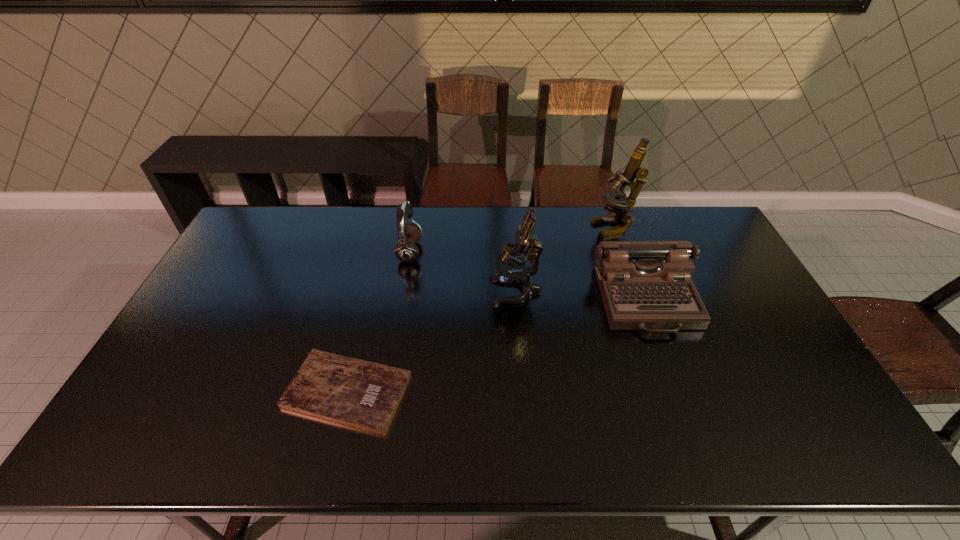
Locate an element on the screen. The height and width of the screenshot is (540, 960). vacant space positioned 0.160m at the eyepieces of the third object from right to left is located at coordinates (439, 292).

The height and width of the screenshot is (540, 960). In order to click on free location located 0.090m on the ear pads of the earphone in this screenshot , I will do `click(447, 252)`.

The height and width of the screenshot is (540, 960). In order to click on free space located on the keyboard of the second shortest object in this screenshot , I will do `click(672, 370)`.

Identify the location of vacant region located on the left of the nearest object. The image size is (960, 540). (176, 392).

This screenshot has height=540, width=960. What are the coordinates of `microscope at the far edge` in the screenshot? It's located at (617, 204).

Where is `earphone present at the far edge`? Image resolution: width=960 pixels, height=540 pixels. earphone present at the far edge is located at coordinates [406, 251].

You are a GUI agent. You are given a task and a screenshot of the screen. Output one action in this format:
    pyautogui.click(x=<x>, y=<y>)
    Task: Click on the object that is positioned at the near edge
    The width and height of the screenshot is (960, 540).
    Given the screenshot: What is the action you would take?
    pyautogui.click(x=361, y=394)

Identify the location of vacant space at the far edge of the desktop. (459, 221).

Image resolution: width=960 pixels, height=540 pixels. Find the location of `vacant region at the near edge of the desktop`. vacant region at the near edge of the desktop is located at coordinates (529, 446).

The height and width of the screenshot is (540, 960). I want to click on vacant area at the left edge, so click(x=189, y=321).